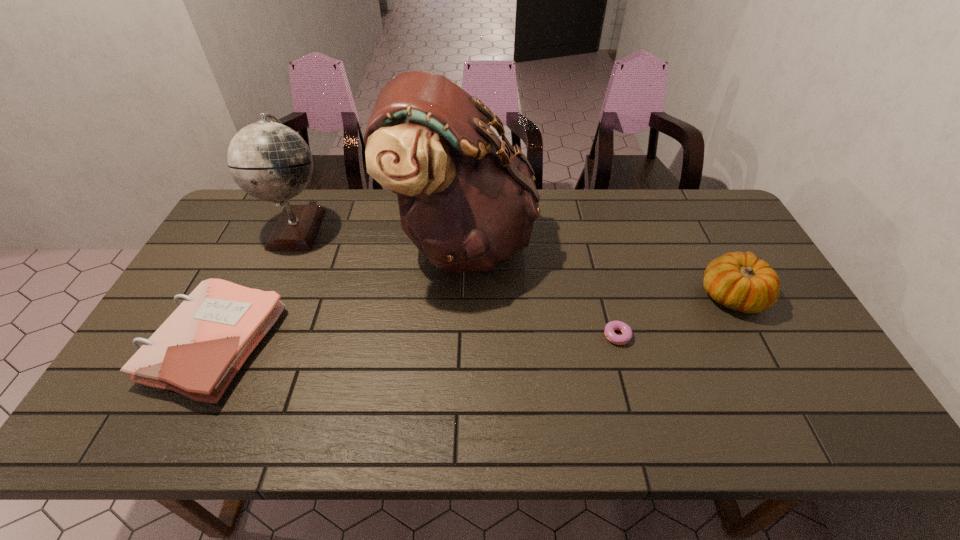
You are a GUI agent. You are given a task and a screenshot of the screen. Output one action in this format:
    pyautogui.click(x=<x>, y=<y>)
    Task: Click on the free spot that satisfies the following two spatial constraints: 1. at the equator of the globe; 2. on the left side of the doughnut
    
    Given the screenshot: What is the action you would take?
    pyautogui.click(x=249, y=336)

At what (x,y) coordinates should I click in order to perform the action: click on free space that satisfies the following two spatial constraints: 1. at the equator of the gourd; 2. on the left side of the globe. Please return your answer as a coordinate pair (x, y). The image size is (960, 540). Looking at the image, I should click on (267, 296).